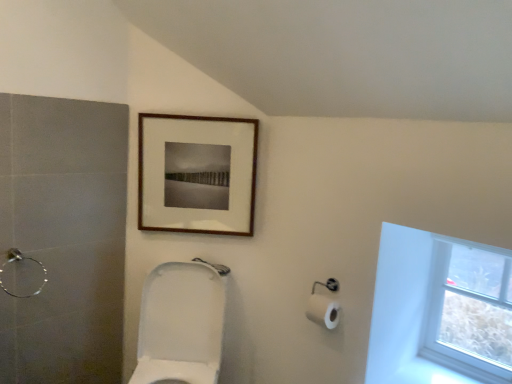
Question: Is wooden picture frame at upper center shorter than brushed metal shower at left?

Choices:
 (A) yes
 (B) no

Answer: (B)

Question: From the image's perspective, would you say wooden picture frame at upper center is positioned over brushed metal shower at left?

Choices:
 (A) yes
 (B) no

Answer: (A)

Question: From a real-world perspective, does wooden picture frame at upper center sit lower than brushed metal shower at left?

Choices:
 (A) no
 (B) yes

Answer: (A)

Question: Does wooden picture frame at upper center have a greater height compared to brushed metal shower at left?

Choices:
 (A) no
 (B) yes

Answer: (B)

Question: Would you consider wooden picture frame at upper center to be distant from brushed metal shower at left?

Choices:
 (A) yes
 (B) no

Answer: (B)

Question: Is point (432, 342) closer or farther from the camera than point (159, 306)?

Choices:
 (A) farther
 (B) closer

Answer: (A)

Question: Would you say transparent glass window at upper right is to the left or to the right of white glossy toilet at center in the picture?

Choices:
 (A) left
 (B) right

Answer: (B)

Question: In the image, is transparent glass window at upper right positioned in front of or behind white glossy toilet at center?

Choices:
 (A) front
 (B) behind

Answer: (B)

Question: From their relative heights in the image, would you say transparent glass window at upper right is taller or shorter than white glossy toilet at center?

Choices:
 (A) tall
 (B) short

Answer: (B)

Question: Looking at their shapes, would you say white glossy toilet at center is wider or thinner than brushed metal shower at left?

Choices:
 (A) wide
 (B) thin

Answer: (A)

Question: Considering the positions of white glossy toilet at center and brushed metal shower at left in the image, is white glossy toilet at center taller or shorter than brushed metal shower at left?

Choices:
 (A) short
 (B) tall

Answer: (B)

Question: In the image, is white glossy toilet at center positioned in front of or behind brushed metal shower at left?

Choices:
 (A) front
 (B) behind

Answer: (A)

Question: From a real-world perspective, is white glossy toilet at center physically located above or below brushed metal shower at left?

Choices:
 (A) below
 (B) above

Answer: (A)

Question: Considering the positions of white glossy toilet at center and transparent glass window at upper right in the image, is white glossy toilet at center wider or thinner than transparent glass window at upper right?

Choices:
 (A) wide
 (B) thin

Answer: (A)

Question: In the image, is white glossy toilet at center positioned in front of or behind transparent glass window at upper right?

Choices:
 (A) behind
 (B) front

Answer: (B)